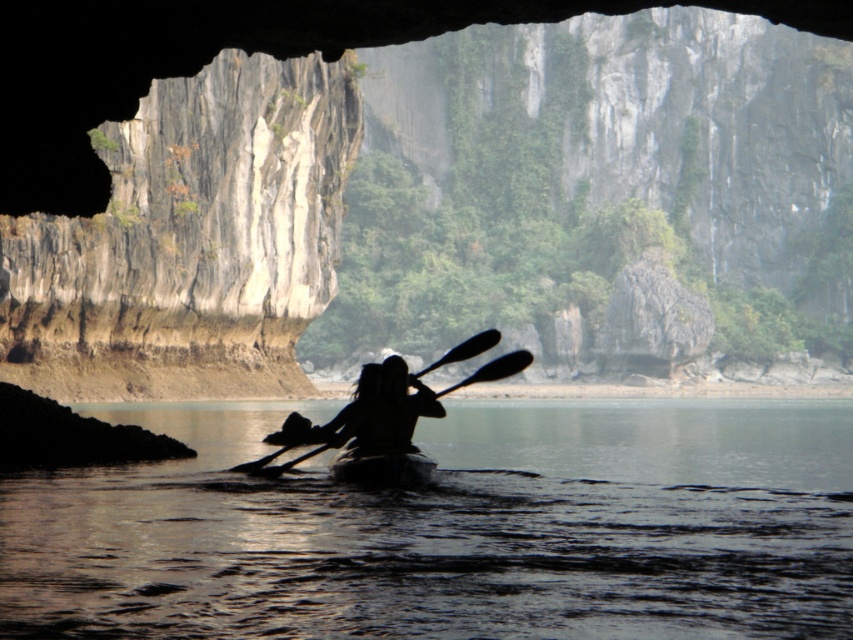
Question: From the image, what is the correct spatial relationship of silhouette wood paddle at center in relation to black matte paddle at center?

Choices:
 (A) left
 (B) right

Answer: (B)

Question: Considering the real-world distances, which object is closest to the silhouette wood paddle at center?

Choices:
 (A) smooth dark gray canoe at center
 (B) black matte paddle at center

Answer: (A)

Question: Based on their relative distances, which object is farther from the transparent water at center?

Choices:
 (A) silhouette wood paddle at center
 (B) black matte paddle at center

Answer: (B)

Question: Is the position of silhouette wood paddle at center more distant than that of black matte paddle at center?

Choices:
 (A) yes
 (B) no

Answer: (B)

Question: Can you confirm if silhouette wood paddle at center is positioned above black matte paddle at center?

Choices:
 (A) no
 (B) yes

Answer: (B)

Question: Which point is farther to the camera?

Choices:
 (A) (416, 570)
 (B) (294, 460)
 (C) (358, 461)
 (D) (335, 436)

Answer: (B)